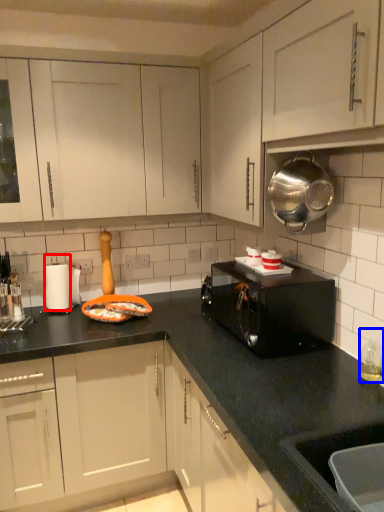
Question: Which object is further to the camera taking this photo, appliance (highlighted by a red box) or bottle (highlighted by a blue box)?

Choices:
 (A) appliance
 (B) bottle

Answer: (A)